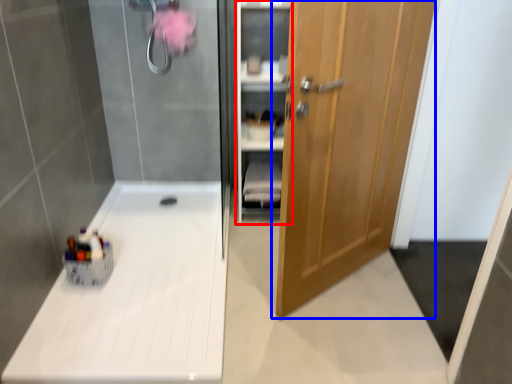
Question: Which point is closer to the camera, cabinet (highlighted by a red box) or door (highlighted by a blue box)?

Choices:
 (A) cabinet
 (B) door

Answer: (B)